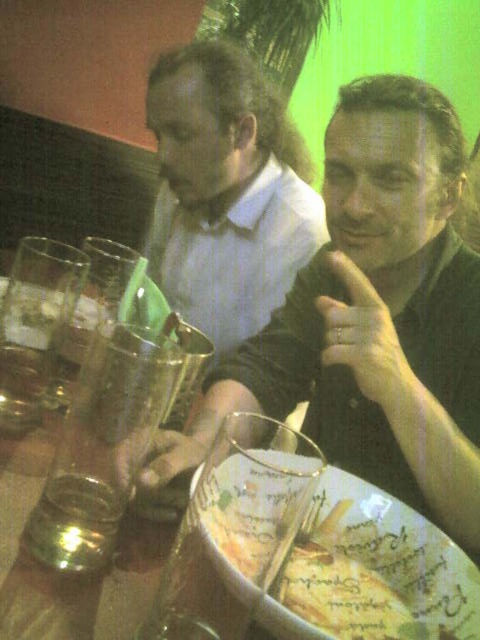
You are a photographer trying to capture a candid shot of the matte black shirt at center and the shiny metallic glass at table center. If you want to ensure both subjects are fully visible in the frame, which subject should you position closer to the camera to avoid cropping?

The matte black shirt at center should be positioned closer to the camera because it might be wider than the shiny metallic glass at table center, ensuring both fit within the frame without cropping.